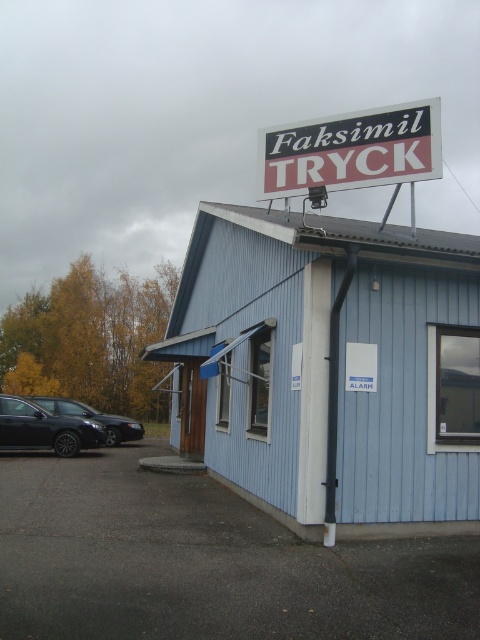
You are standing at the entrance of the building and want to park your car in the gray asphalt parking lot at lower left. What are the coordinates of the parking lot?

The gray asphalt parking lot at lower left is located at coordinates point (204, 561).

You are standing at the entrance of the building and need to park your car in the gray asphalt parking lot at lower left. The matte black car at left is already parked there. Can you estimate if your car will fit in the remaining space?

The gray asphalt parking lot at lower left has a width larger than the matte black car at left, so there should be enough space for your car to fit in the remaining area.

You are driving a car and want to park in the gray asphalt parking lot at lower left. However, there is a black plastic sign at upper center in your way. Can you drive around the sign to reach the parking lot?

The gray asphalt parking lot at lower left is much taller than the black plastic sign at upper center, so you can drive around the sign to reach the parking lot.